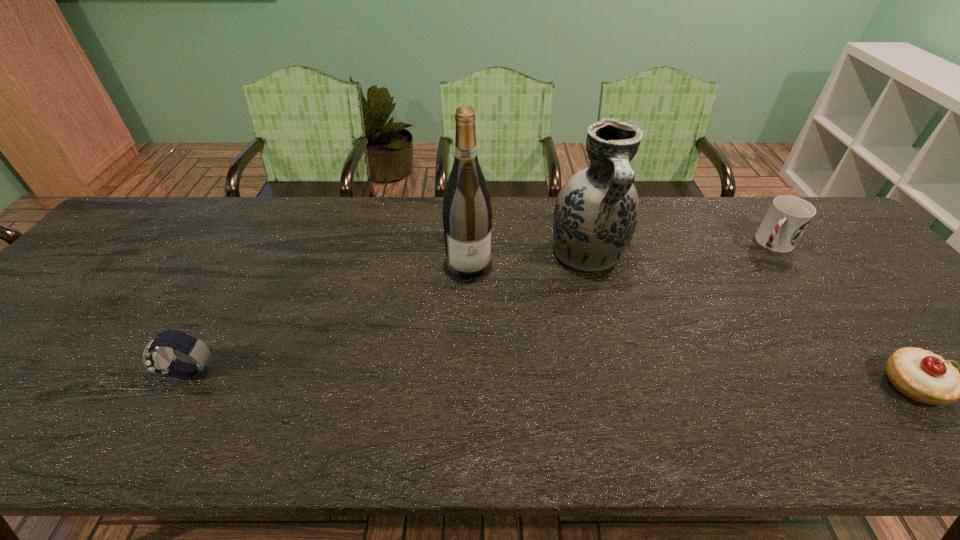
Locate an element on the screen. The width and height of the screenshot is (960, 540). free space on the desktop that is between the watch and the shortest object and is positioned with the handle on the side of the vase is located at coordinates (643, 381).

Image resolution: width=960 pixels, height=540 pixels. I want to click on free space on the desktop that is between the leftmost object and the pastry and is positioned on the label of the wine bottle, so click(x=498, y=378).

Find the location of `free space on the desktop that is between the watch and the shortest object and is positioned on the handle side of the cup`. free space on the desktop that is between the watch and the shortest object and is positioned on the handle side of the cup is located at coordinates tap(652, 381).